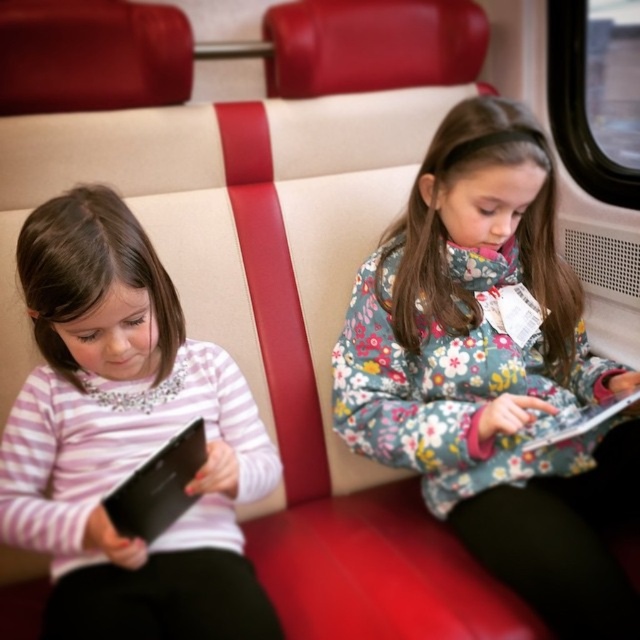
Is point (632, 497) behind point (92, 490)?

Yes, point (632, 497) is farther from viewer.

Can you confirm if floral fabric jacket at center is wider than pink striped shirt at left?

Correct, the width of floral fabric jacket at center exceeds that of pink striped shirt at left.

Where is `floral fabric jacket at center`? The image size is (640, 640). floral fabric jacket at center is located at coordinates (492, 372).

Identify the location of floral fabric jacket at center. (492, 372).